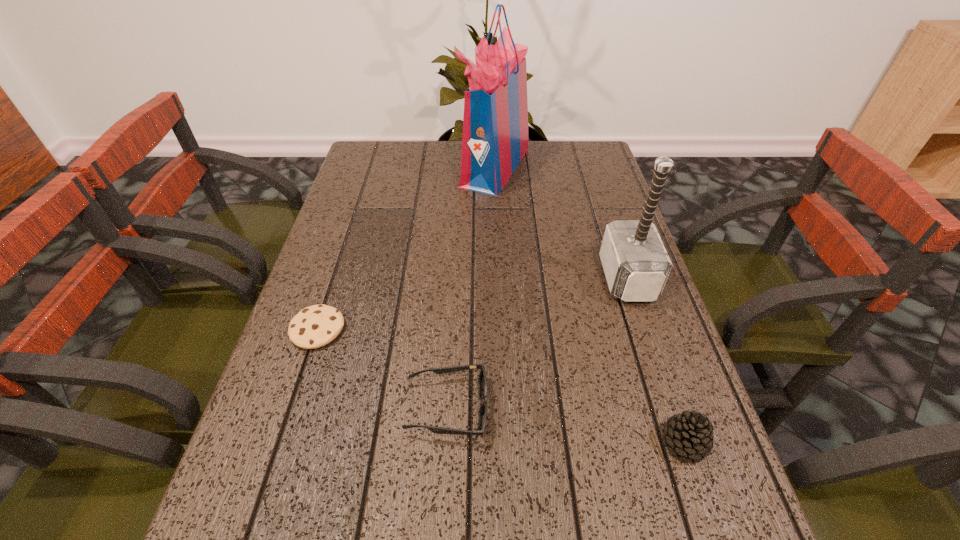
Image resolution: width=960 pixels, height=540 pixels. Find the location of `the farthest object`. the farthest object is located at coordinates (495, 125).

The image size is (960, 540). I want to click on the tallest object, so click(x=495, y=125).

Image resolution: width=960 pixels, height=540 pixels. I want to click on the second farthest object, so click(636, 264).

This screenshot has width=960, height=540. In order to click on the fourth shortest object in this screenshot , I will do `click(636, 264)`.

I want to click on the third tallest object, so pyautogui.click(x=690, y=435).

Identify the location of sunglasses. This screenshot has width=960, height=540. (482, 383).

The image size is (960, 540). In order to click on cookie in this screenshot , I will do `click(313, 327)`.

The image size is (960, 540). What are the coordinates of `the leftmost object` in the screenshot? It's located at (313, 327).

Where is `vacant space located 0.260m on the front-facing side of the tallest object`? vacant space located 0.260m on the front-facing side of the tallest object is located at coordinates (375, 166).

The width and height of the screenshot is (960, 540). Identify the location of vacant space positioned 0.300m on the front-facing side of the tallest object. (362, 166).